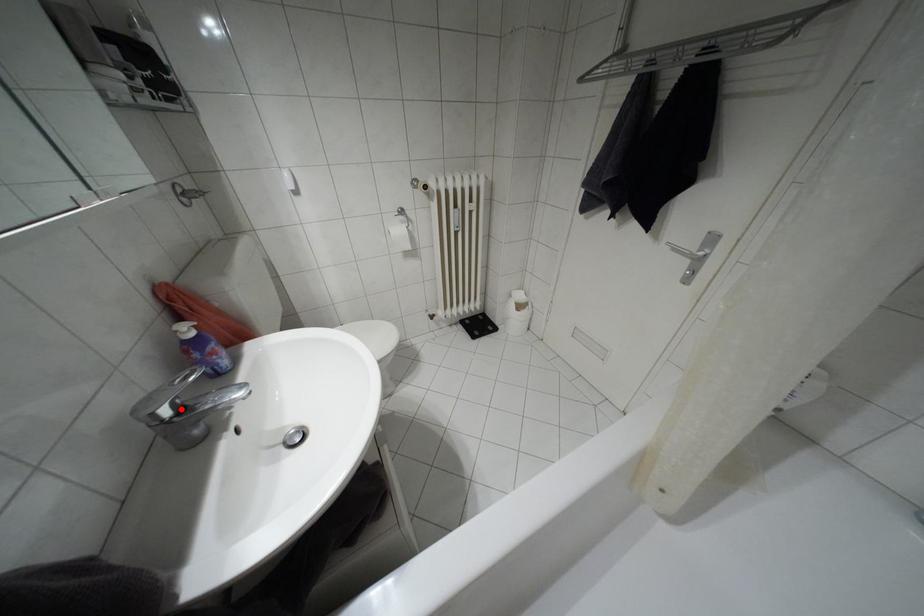
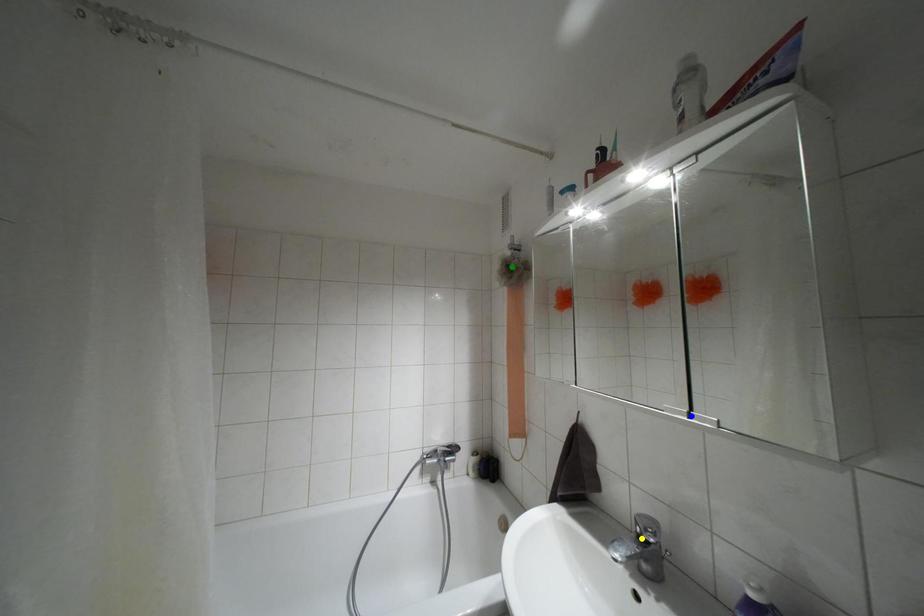
Question: I am providing you with two images of the same scene from different viewpoints. A red point is marked on the first image. You are given multiple points on the second image. Can you choose the point in image 2 that corresponds to the point in image 1?

Choices:
 (A) yellow point
 (B) green point
 (C) blue point

Answer: (A)